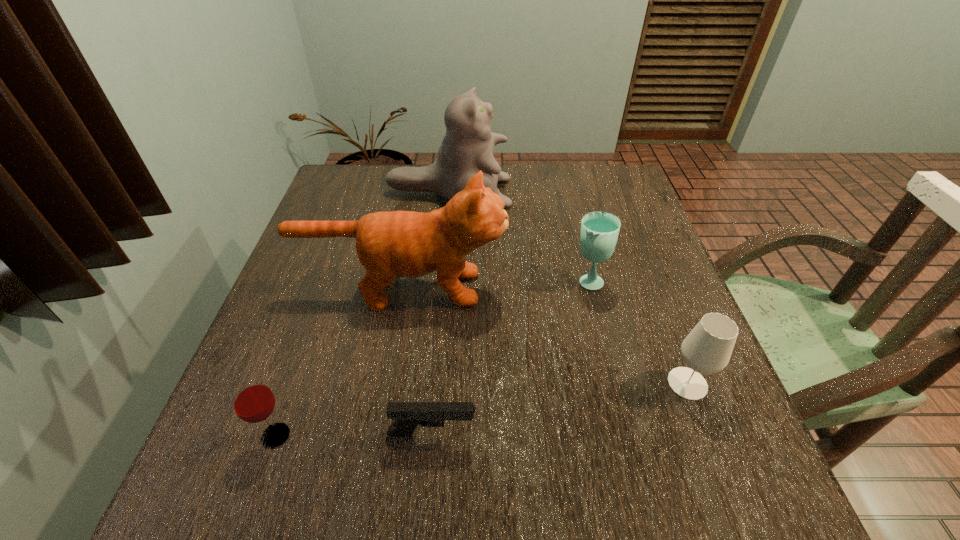
Identify the location of free space located 0.300m on the front of the second glass from left to right. This screenshot has width=960, height=540. (621, 413).

You are a GUI agent. You are given a task and a screenshot of the screen. Output one action in this format:
    pyautogui.click(x=<x>, y=<y>)
    Task: Click on the free space located 0.130m on the left of the rightmost object
    This screenshot has height=540, width=960.
    Given the screenshot: What is the action you would take?
    pyautogui.click(x=598, y=383)

The image size is (960, 540). I want to click on vacant position located 0.070m on the left of the nearest glass, so click(x=219, y=436).

Image resolution: width=960 pixels, height=540 pixels. Identify the location of vacant area situated 0.080m on the front-facing side of the pistol. (522, 436).

Identify the location of object located at the far edge. The width and height of the screenshot is (960, 540). (468, 146).

You are a GUI agent. You are given a task and a screenshot of the screen. Output one action in this format:
    pyautogui.click(x=<x>, y=<y>)
    Task: Click on the cat that is at the left edge
    Image resolution: width=960 pixels, height=540 pixels.
    Given the screenshot: What is the action you would take?
    pyautogui.click(x=407, y=244)

Identify the location of glass that is positioned at the left edge. This screenshot has height=540, width=960. (252, 400).

Where is `vacant space at the near edge of the desktop`? The image size is (960, 540). vacant space at the near edge of the desktop is located at coordinates (646, 494).

In the image, there is a desktop. Where is `vacant space at the right edge`? Image resolution: width=960 pixels, height=540 pixels. vacant space at the right edge is located at coordinates (744, 450).

The width and height of the screenshot is (960, 540). In the image, there is a desktop. Find the location of `vacant space at the far right corner`. vacant space at the far right corner is located at coordinates (612, 174).